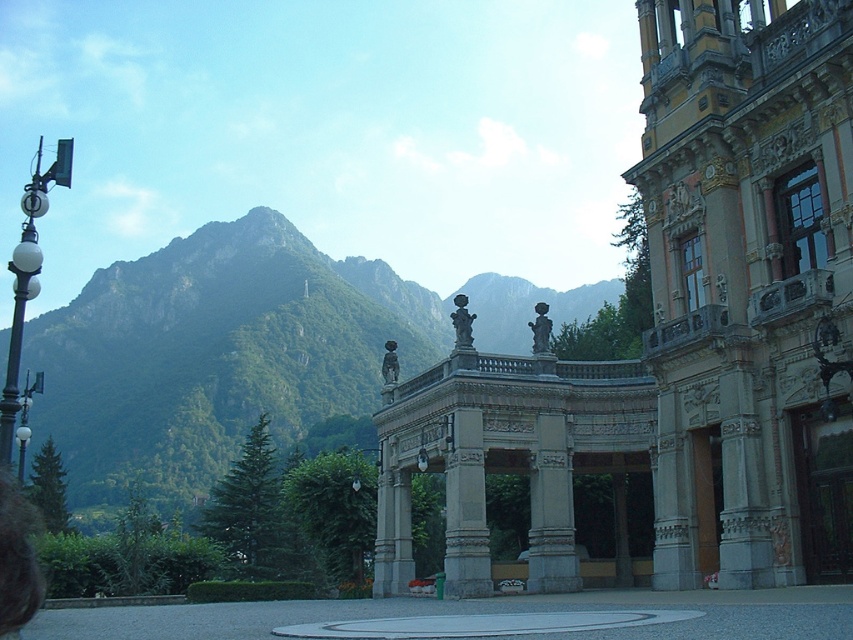
Question: Based on their relative distances, which object is nearer to the matte black statue at center?

Choices:
 (A) green rocky mountain at upper left
 (B) gray stone archway at center
 (C) matte gray statue at center
 (D) polished bronze door at center right

Answer: (C)

Question: Which point appears farthest from the camera in this image?

Choices:
 (A) (459, 330)
 (B) (397, 316)
 (C) (805, 426)
 (D) (531, 330)

Answer: (B)

Question: Is matte black statue at center wider than matte gray statue at center?

Choices:
 (A) yes
 (B) no

Answer: (A)

Question: In this image, where is gray stone archway at center located relative to polished bronze door at center right?

Choices:
 (A) right
 (B) left

Answer: (B)

Question: Which point appears farthest from the camera in this image?

Choices:
 (A) (840, 410)
 (B) (263, 353)
 (C) (828, 381)

Answer: (B)

Question: Is green rocky mountain at upper left below matte gray statue at center?

Choices:
 (A) no
 (B) yes

Answer: (A)